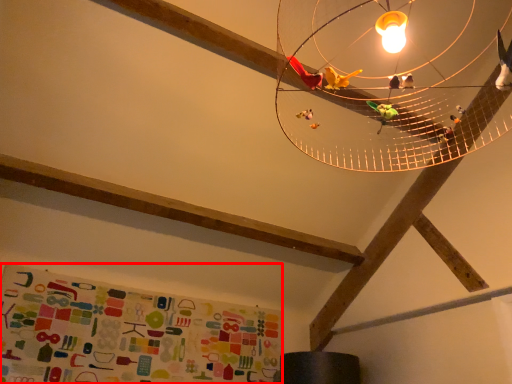
Question: From the image's perspective, considering the relative positions of bulletin board (annotated by the red box) and lamp in the image provided, where is bulletin board (annotated by the red box) located with respect to the staircase?

Choices:
 (A) above
 (B) below

Answer: (B)